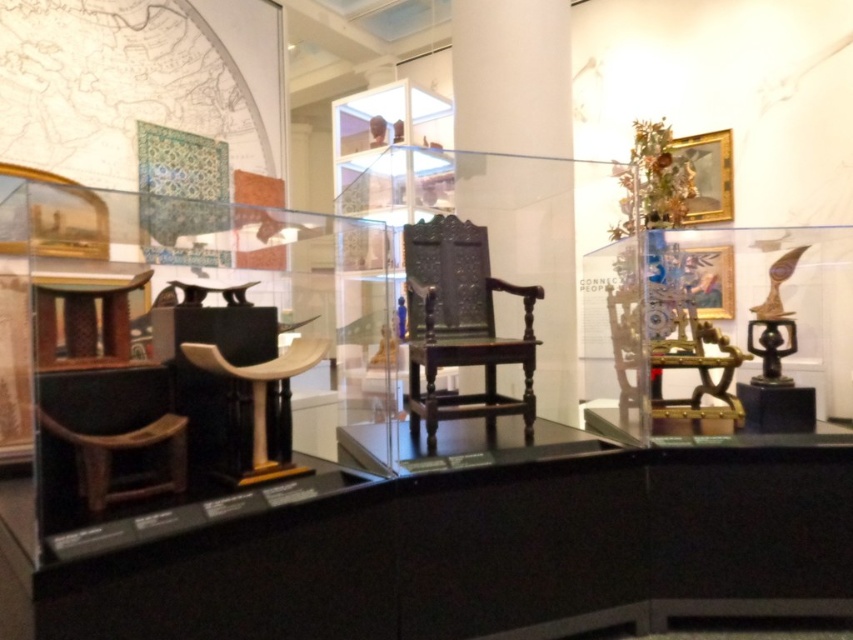
You are a visitor at the museum and want to take a photo of both the dark wood carved chair at center and the wooden chair at center. Which chair should you focus on first to ensure both are in the frame?

You should focus on the dark wood carved chair at center first because it is closer to you than the wooden chair at center, ensuring both are in the frame.

You are standing in front of the museum exhibit and want to determine the relative positions of two points marked in the scene. Which point is closer to you, point at coordinates (469, 272) or point at coordinates (310, 365)?

Point at coordinates (469, 272) is closer to you than point at coordinates (310, 365) because it is further to the viewer according to the description.